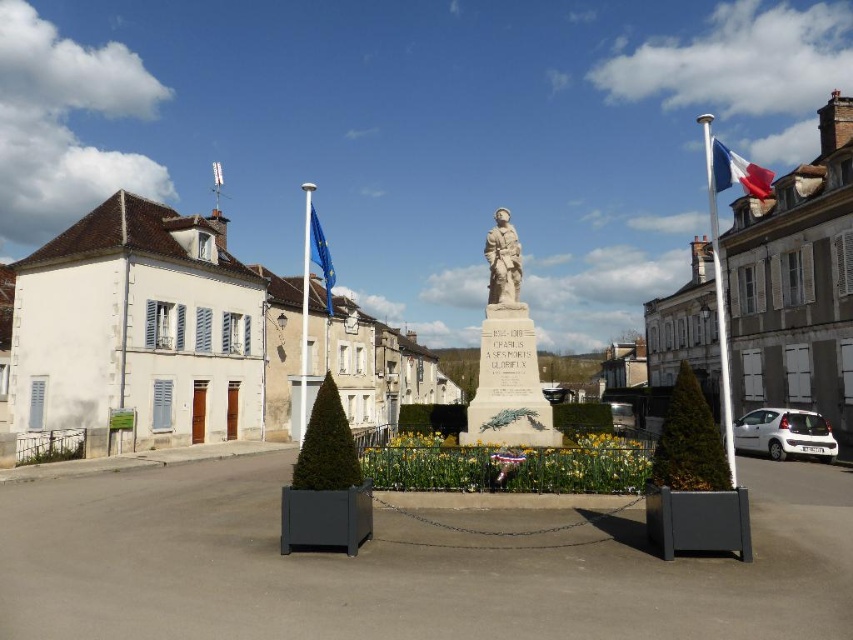
You are a tourist visiting the town square and want to take a photo that includes both the white stone building at center and the white stone soldier at center. Based on their sizes, which one should you focus on to ensure both fit in the frame?

The white stone building at center is larger in size than the white stone soldier at center, so you should focus on the white stone building at center to ensure both fit in the frame.

You are standing in the town square and want to take a photo of both the European Union flag and the French flag. You notice two points marked in the image. Which point is closer to you, point (479, 397) or point (320, 259)?

Point (479, 397) is further to the viewer than point (320, 259), so point (320, 259) is closer to you.